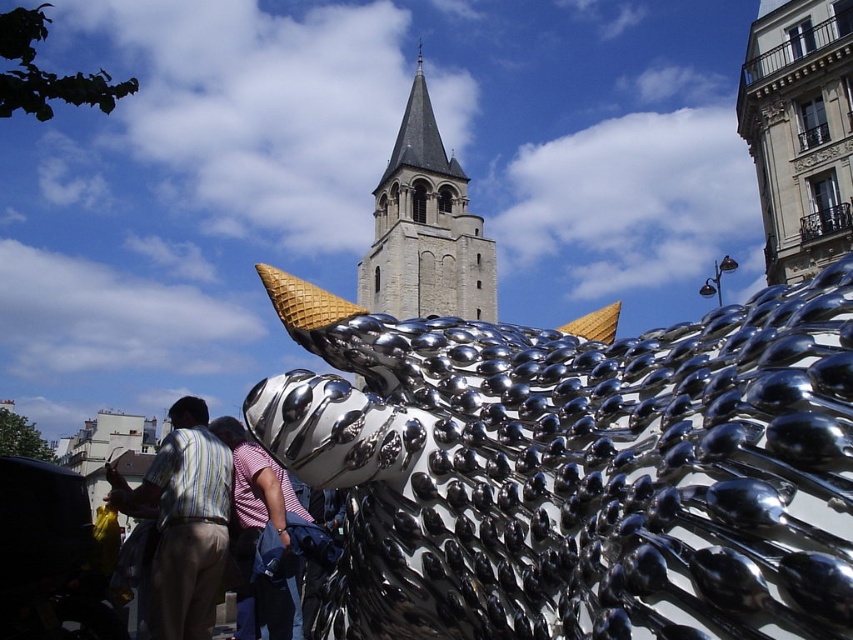
In the scene shown: You are a photographer standing at the base of the gray stone tower at center. You want to take a photo of the striped fabric shirt at lower left without any obstructions. Given that the dragon sculpture is between you and the shirt, can you still capture the shirt in the frame?

The distance between the gray stone tower at center and the striped fabric shirt at lower left is 210.12 feet. Since the dragon sculpture is between them, it may obstruct the view. However, without knowing the dragon sculpture size or exact position, it is impossible to determine if the striped fabric shirt at lower left will be visible in the photo.

You are an artist trying to paint the scene. You notice the gray stone tower at center and the striped cotton shirt at center. Which object should you focus on first if you want to paint the wider object first?

The gray stone tower at center might be wider than striped cotton shirt at center, so you should focus on painting the gray stone tower at center first.